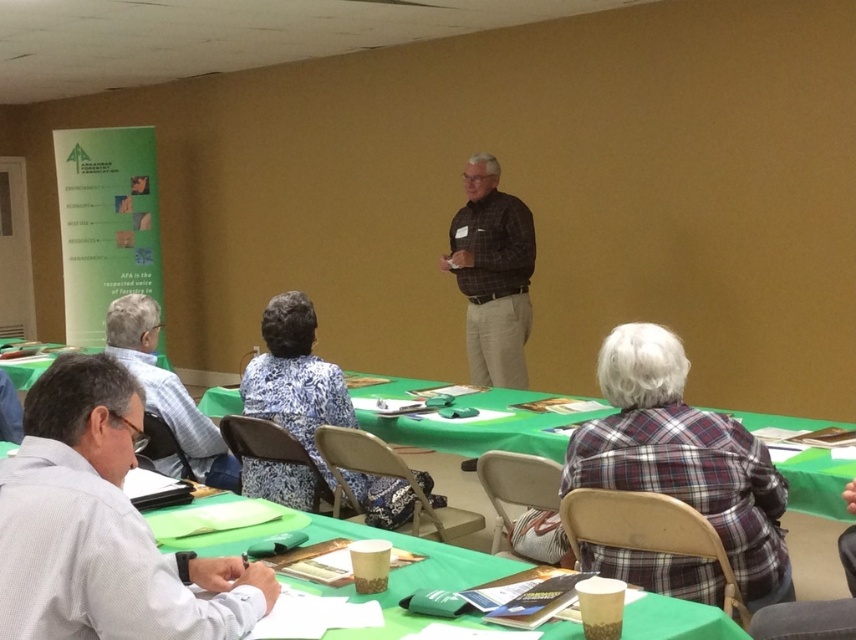
Can you confirm if blue floral dress at center is wider than gray fabric shirt at lower left?

Indeed, blue floral dress at center has a greater width compared to gray fabric shirt at lower left.

Is point (274, 349) in front of point (152, 308)?

Yes, point (274, 349) is closer to viewer.

Locate an element on the screen. blue floral dress at center is located at coordinates (295, 378).

Based on the photo, does blue floral dress at center have a lesser width compared to green fabric table at lower center?

Yes.

Who is more distant from viewer, (440, 499) or (218, 406)?

Point (218, 406)

This screenshot has height=640, width=856. In order to click on blue floral dress at center in this screenshot , I will do `click(295, 378)`.

Can you confirm if white shirt at left is wider than green fabric table at lower center?

No.

Is white shirt at left to the right of green fabric table at lower center from the viewer's perspective?

In fact, white shirt at left is to the left of green fabric table at lower center.

Which is in front, point (16, 531) or point (569, 396)?

Point (16, 531) is in front.

At what (x,y) coordinates should I click in order to perform the action: click on white shirt at left. Please return your answer as a coordinate pair (x, y). The width and height of the screenshot is (856, 640). Looking at the image, I should click on (100, 525).